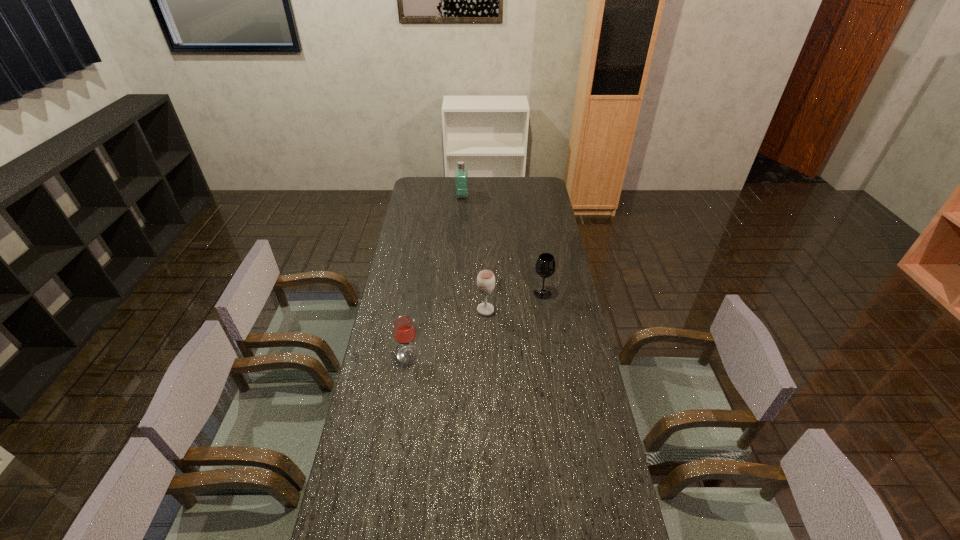
At what (x,y) coordinates should I click in order to perform the action: click on the closest object relative to the second nearest wineglass. Please return your answer as a coordinate pair (x, y). Looking at the image, I should click on (545, 266).

Choose which wineglass is the second nearest neighbor to the perfume. Please provide its 2D coordinates. Your answer should be formatted as a tuple, i.e. [(x, y)], where the tuple contains the x and y coordinates of a point satisfying the conditions above.

[(485, 280)]

Identify which wineglass is the nearest to the farthest wineglass. Please provide its 2D coordinates. Your answer should be formatted as a tuple, i.e. [(x, y)], where the tuple contains the x and y coordinates of a point satisfying the conditions above.

[(485, 280)]

Where is `vacant area in the image that satisfies the following two spatial constraints: 1. on the back side of the second farthest object; 2. on the left side of the leftmost object`? The width and height of the screenshot is (960, 540). vacant area in the image that satisfies the following two spatial constraints: 1. on the back side of the second farthest object; 2. on the left side of the leftmost object is located at coordinates (419, 293).

The width and height of the screenshot is (960, 540). Identify the location of vacant space that satisfies the following two spatial constraints: 1. on the front label of the second object from right to left; 2. on the left side of the second object from left to right. (455, 310).

Where is `free location that satisfies the following two spatial constraints: 1. on the front label of the rightmost wineglass; 2. on the right side of the third object from right to left`? The image size is (960, 540). free location that satisfies the following two spatial constraints: 1. on the front label of the rightmost wineglass; 2. on the right side of the third object from right to left is located at coordinates (456, 293).

The image size is (960, 540). What are the coordinates of `vacant region that satisfies the following two spatial constraints: 1. on the front label of the farthest object; 2. on the back side of the rightmost wineglass` in the screenshot? It's located at (456, 293).

You are a GUI agent. You are given a task and a screenshot of the screen. Output one action in this format:
    pyautogui.click(x=<x>, y=<y>)
    Task: Click on the vacant region that satisfies the following two spatial constraints: 1. on the back side of the nearest wineglass; 2. on the right side of the third nearest object
    The image size is (960, 540).
    Given the screenshot: What is the action you would take?
    pyautogui.click(x=419, y=293)

Where is `vacant region that satisfies the following two spatial constraints: 1. on the back side of the farthest wineglass; 2. on the front label of the second object from left to right`? vacant region that satisfies the following two spatial constraints: 1. on the back side of the farthest wineglass; 2. on the front label of the second object from left to right is located at coordinates (527, 195).